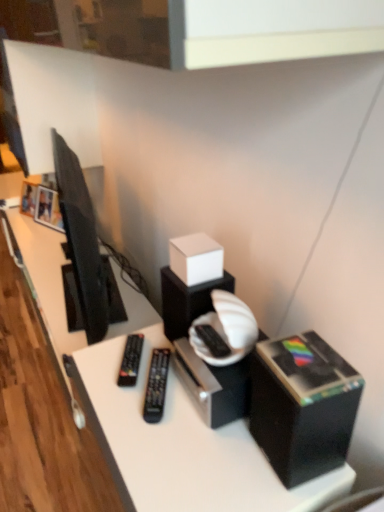
Question: In which direction should I rotate to look at white matte cube at center, arranged as the first box when viewed from the back?

Choices:
 (A) left
 (B) right

Answer: (B)

Question: Is black plastic box at lower right, marked as the 2th box in a top-to-bottom arrangement, positioned with its back to white matte cube at center, placed as the first box when sorted from left to right?

Choices:
 (A) yes
 (B) no

Answer: (B)

Question: Can you confirm if black plastic box at lower right, which is counted as the 1th box, starting from the front, is smaller than white matte cube at center, placed as the 2th box when sorted from front to back?

Choices:
 (A) yes
 (B) no

Answer: (B)

Question: Can you confirm if black plastic box at lower right, the first box positioned from the right, is positioned to the right of white matte cube at center, placed as the 2th box when sorted from front to back?

Choices:
 (A) no
 (B) yes

Answer: (B)

Question: Considering the relative sizes of black plastic box at lower right, acting as the second box starting from the left, and white matte cube at center, placed as the 2th box when sorted from front to back, in the image provided, is black plastic box at lower right, acting as the second box starting from the left, taller than white matte cube at center, placed as the 2th box when sorted from front to back,?

Choices:
 (A) no
 (B) yes

Answer: (B)

Question: Considering the relative sizes of black plastic box at lower right, the 2th box positioned from the back, and white matte cube at center, placed as the 2th box when sorted from front to back, in the image provided, is black plastic box at lower right, the 2th box positioned from the back, thinner than white matte cube at center, placed as the 2th box when sorted from front to back,?

Choices:
 (A) yes
 (B) no

Answer: (B)

Question: Can you confirm if matte black television at left is smaller than black plastic remote at center, which is counted as the first equipment, starting from the left?

Choices:
 (A) yes
 (B) no

Answer: (B)

Question: From the image's perspective, is matte black television at left on top of black plastic remote at center, which is counted as the first equipment, starting from the left?

Choices:
 (A) no
 (B) yes

Answer: (B)

Question: From the image's perspective, is matte black television at left below black plastic remote at center, arranged as the 2th equipment when viewed from the right?

Choices:
 (A) no
 (B) yes

Answer: (A)

Question: Would you say matte black television at left contains black plastic remote at center, arranged as the 2th equipment when viewed from the right?

Choices:
 (A) no
 (B) yes

Answer: (A)

Question: Is matte black television at left thinner than black plastic remote at center, arranged as the 2th equipment when viewed from the right?

Choices:
 (A) no
 (B) yes

Answer: (A)

Question: Could you tell me if matte black television at left is turned towards black plastic remote at center, arranged as the 2th equipment when viewed from the right?

Choices:
 (A) yes
 (B) no

Answer: (B)

Question: From the image's perspective, is black plastic box at lower right, which is counted as the 1th box, starting from the front, on black plastic remote at center, positioned as the first equipment in right-to-left order?

Choices:
 (A) no
 (B) yes

Answer: (B)